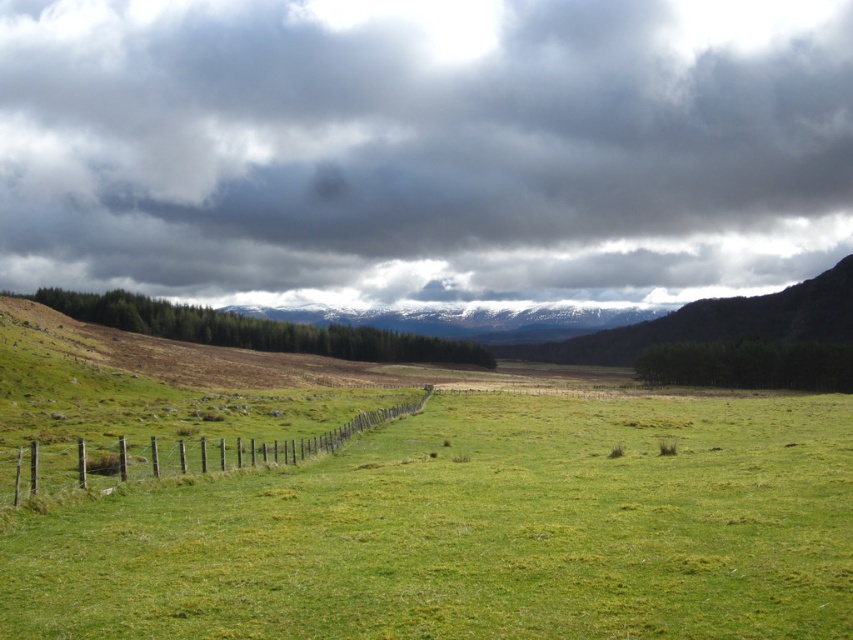
You are an observer looking at the rural landscape. You notice the dark gray cloud at upper center and the green grass pasture at center. Which object is located to the left of the other?

The dark gray cloud at upper center is positioned on the left side of green grass pasture at center.

You are a weather observer in the field. You notice the dark gray cloud at upper center and the green grass pasture at center. Which one appears larger in the sky?

The dark gray cloud at upper center appears larger than the green grass pasture at center in the sky.

You are an artist planning to paint the scene. You need to decide which object to emphasize more in terms of size between the dark gray cloud at upper center and the brown wooden fence at lower left. Based on the actual sizes in the image, which one should you make larger?

The dark gray cloud at upper center is larger in size than the brown wooden fence at lower left, so you should emphasize the dark gray cloud at upper center more in terms of size in your painting.